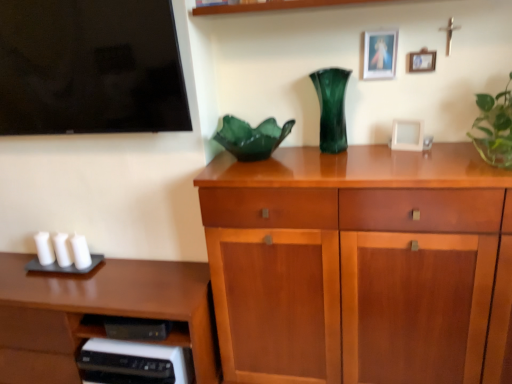
Identify the location of free location in front of white matte candle at lower left, which appears as the first candle when viewed from the left. This screenshot has width=512, height=384. (22, 283).